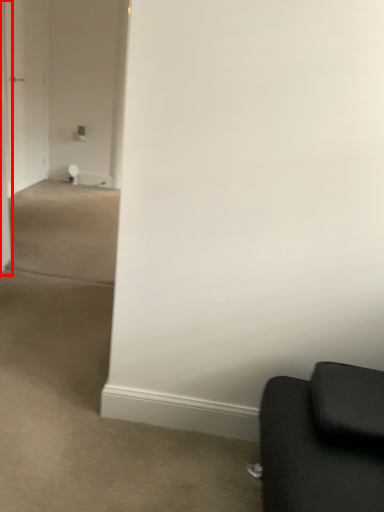
Question: From the image's perspective, what is the correct spatial relationship of door (annotated by the red box) in relation to glass door?

Choices:
 (A) above
 (B) below

Answer: (B)